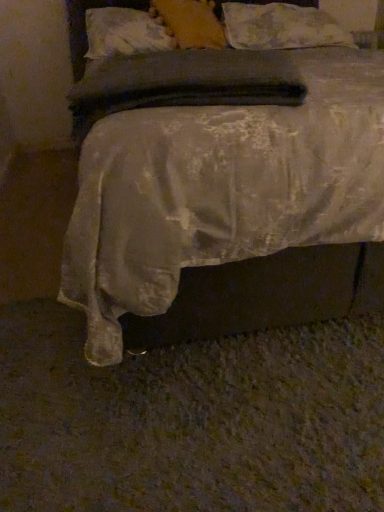
Question: Is fluffy white pillow at upper center, which is the third pillow from left to right, shorter than soft yellow pillow at upper center, which is the 2th pillow in left-to-right order?

Choices:
 (A) no
 (B) yes

Answer: (A)

Question: Is fluffy white pillow at upper center, positioned as the first pillow in right-to-left order, outside of soft yellow pillow at upper center, placed as the 2th pillow when sorted from right to left?

Choices:
 (A) yes
 (B) no

Answer: (A)

Question: Does fluffy white pillow at upper center, positioned as the first pillow in right-to-left order, come behind soft yellow pillow at upper center, placed as the 2th pillow when sorted from right to left?

Choices:
 (A) no
 (B) yes

Answer: (B)

Question: Is fluffy white pillow at upper center, positioned as the first pillow in right-to-left order, oriented towards soft yellow pillow at upper center, placed as the 2th pillow when sorted from right to left?

Choices:
 (A) yes
 (B) no

Answer: (B)

Question: Can you confirm if fluffy white pillow at upper center, which is the third pillow from left to right, is positioned to the left of soft yellow pillow at upper center, which is the 2th pillow in left-to-right order?

Choices:
 (A) yes
 (B) no

Answer: (B)

Question: Is fluffy white pillow at upper center, positioned as the first pillow in right-to-left order, situated inside white textured pillow at upper center, which is counted as the third pillow, starting from the right, or outside?

Choices:
 (A) outside
 (B) inside

Answer: (A)

Question: From the image's perspective, relative to white textured pillow at upper center, which is counted as the third pillow, starting from the right, is fluffy white pillow at upper center, positioned as the first pillow in right-to-left order, above or below?

Choices:
 (A) below
 (B) above

Answer: (B)

Question: Is point (299, 10) positioned closer to the camera than point (160, 29)?

Choices:
 (A) closer
 (B) farther

Answer: (B)

Question: In terms of width, does fluffy white pillow at upper center, which is the third pillow from left to right, look wider or thinner when compared to white textured pillow at upper center, which is counted as the third pillow, starting from the right?

Choices:
 (A) thin
 (B) wide

Answer: (B)

Question: Considering the positions of soft yellow pillow at upper center, which is the 2th pillow in left-to-right order, and white textured pillow at upper center, which is counted as the third pillow, starting from the right, in the image, is soft yellow pillow at upper center, which is the 2th pillow in left-to-right order, taller or shorter than white textured pillow at upper center, which is counted as the third pillow, starting from the right,?

Choices:
 (A) short
 (B) tall

Answer: (B)

Question: From the image's perspective, is soft yellow pillow at upper center, which is the 2th pillow in left-to-right order, located above or below white textured pillow at upper center, arranged as the first pillow when viewed from the left?

Choices:
 (A) above
 (B) below

Answer: (A)

Question: Do you think soft yellow pillow at upper center, placed as the 2th pillow when sorted from right to left, is within white textured pillow at upper center, which is counted as the third pillow, starting from the right, or outside of it?

Choices:
 (A) outside
 (B) inside

Answer: (B)

Question: Is point (157, 10) closer or farther from the camera than point (94, 46)?

Choices:
 (A) closer
 (B) farther

Answer: (B)

Question: From a real-world perspective, is soft yellow pillow at upper center, placed as the 2th pillow when sorted from right to left, positioned above or below silky white bed at center?

Choices:
 (A) above
 (B) below

Answer: (A)

Question: Is soft yellow pillow at upper center, placed as the 2th pillow when sorted from right to left, taller or shorter than silky white bed at center?

Choices:
 (A) short
 (B) tall

Answer: (A)